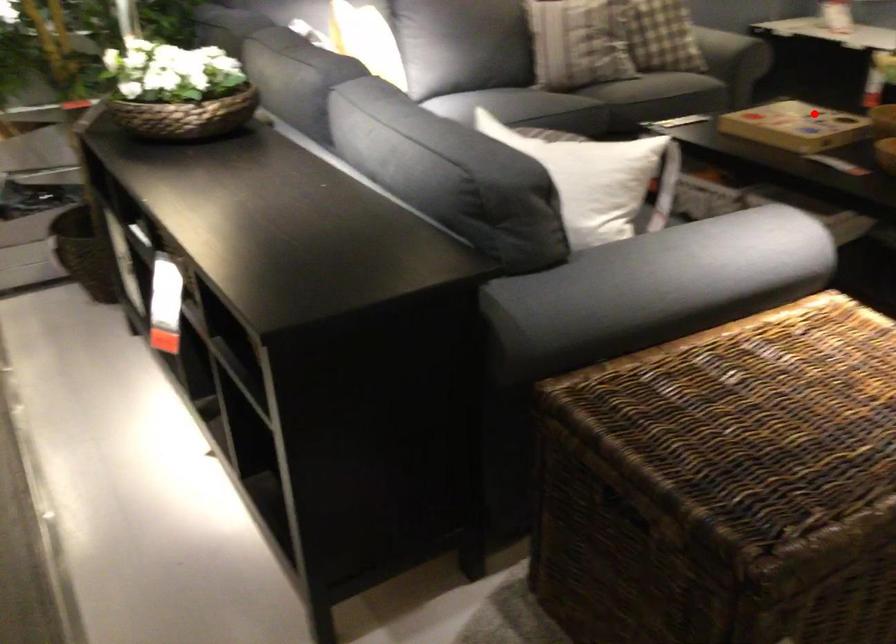
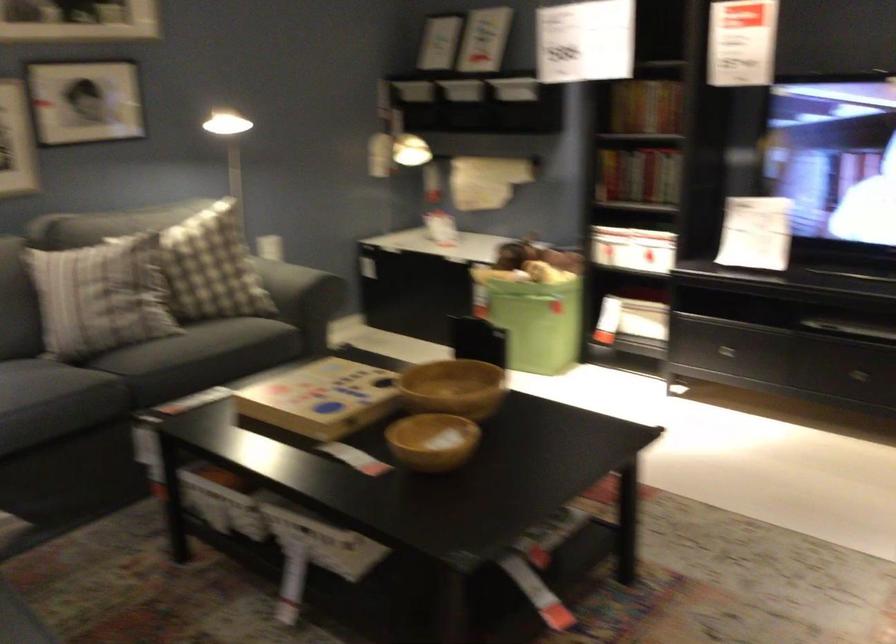
The point at the highlighted location is marked in the first image. Where is the corresponding point in the second image?

(320, 399)